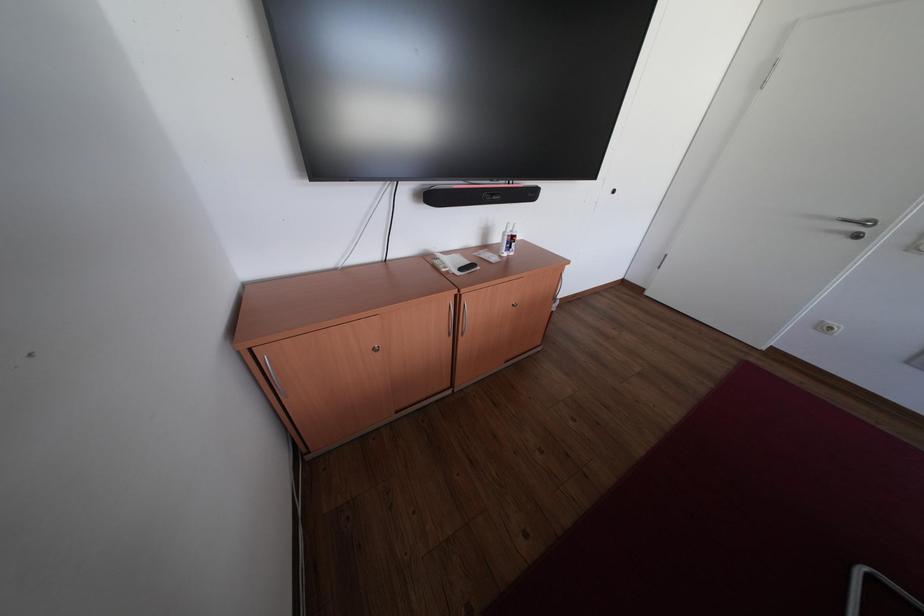
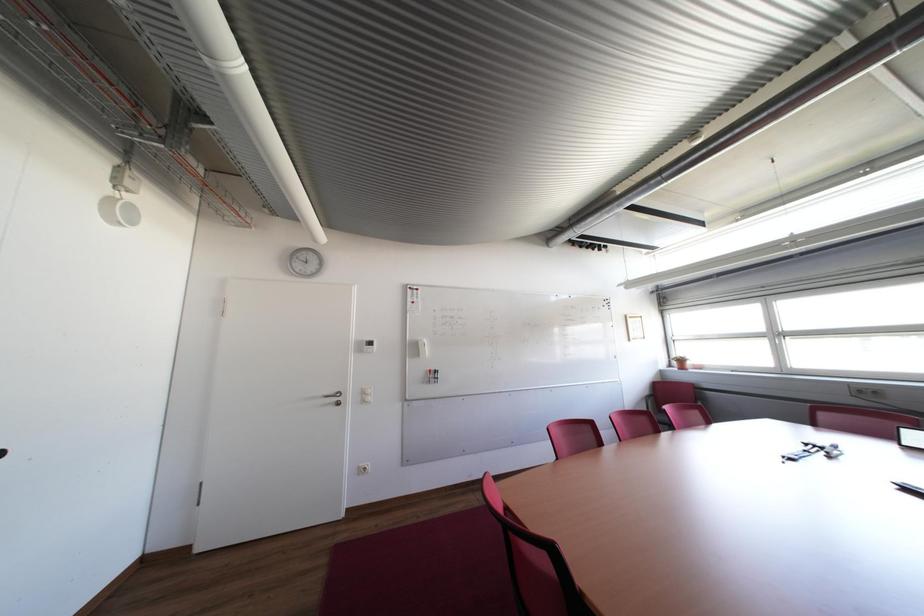
Question: Based on the continuous images, in which direction is the camera rotating? Reply with the corresponding letter.

Choices:
 (A) Left
 (B) Right
 (C) Up
 (D) Down

Answer: (B)